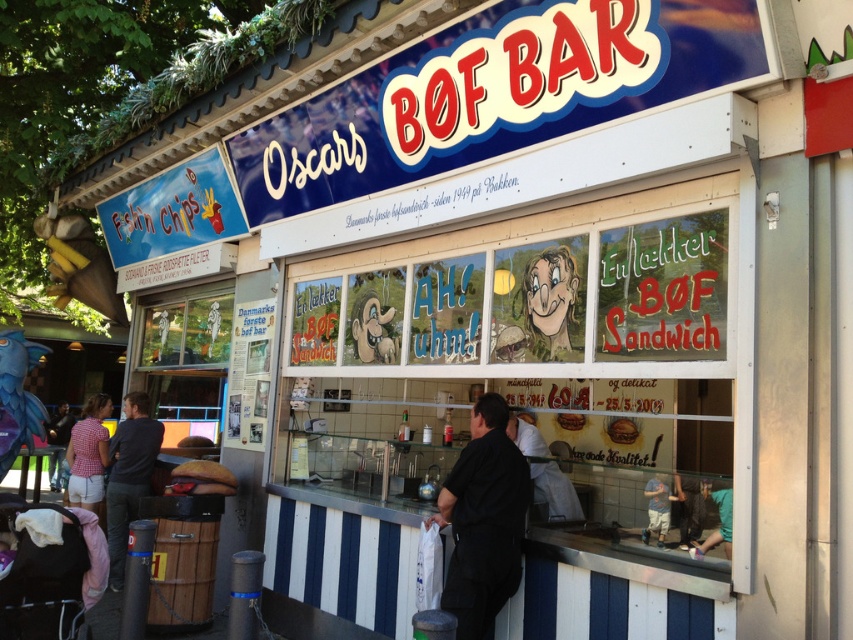
You are a customer at Oscar Bof Bar and you want to order a burger. You see a black matte shirt at center and a plaid shirt at lower left. Which shirt is closer to the right side of the counter?

The black matte shirt at center is closer to the right side of the counter because it is positioned to the right of the plaid shirt at lower left.